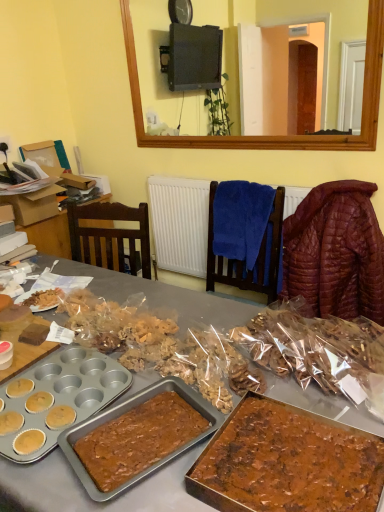
Where is `free space above translucent plastic bag at center, placed as the first snack when sorted from left to right (from a real-world perspective)`? The image size is (384, 512). free space above translucent plastic bag at center, placed as the first snack when sorted from left to right (from a real-world perspective) is located at coordinates (174, 336).